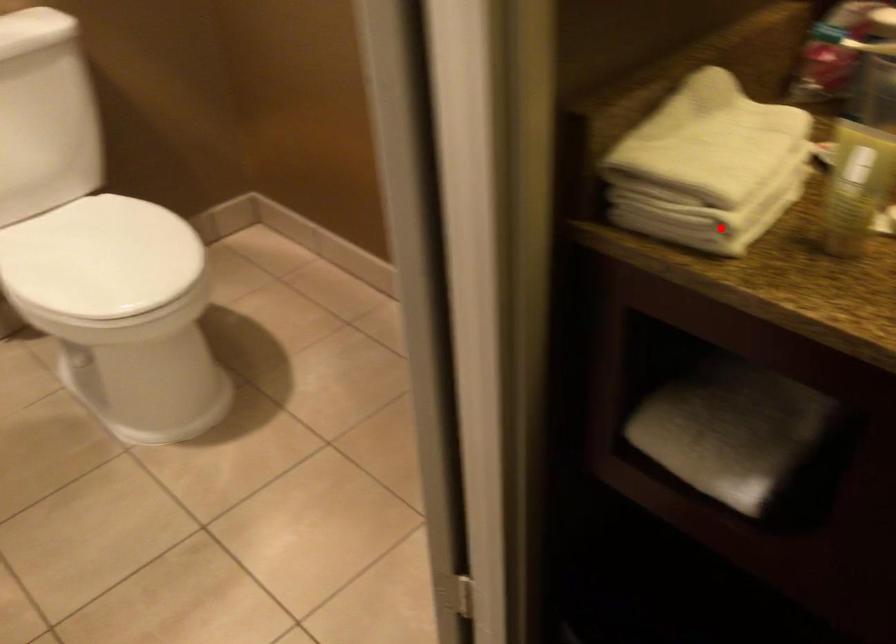
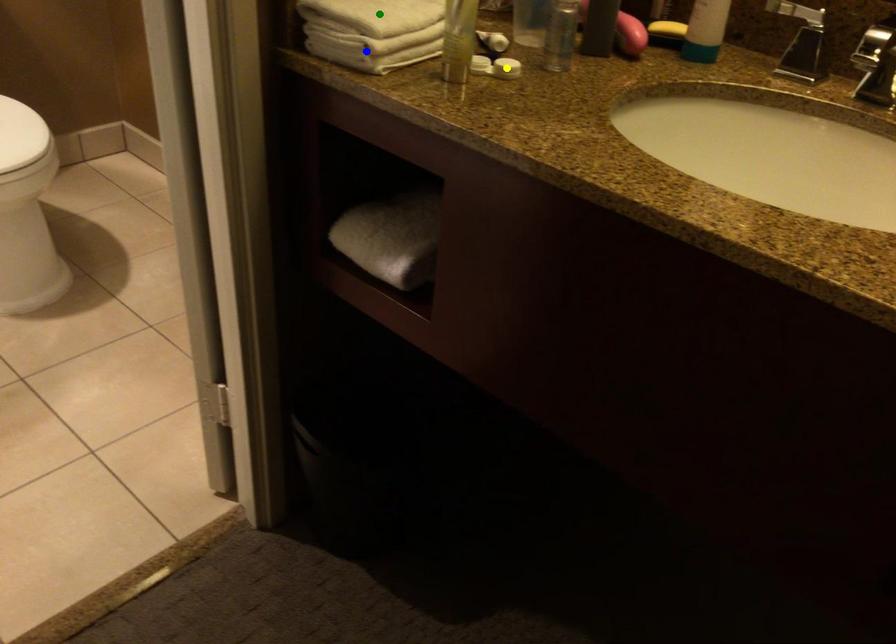
Question: I am providing you with two images of the same scene from different viewpoints. A red point is marked on the first image. You are given multiple points on the second image. Which point in image 2 represents the same 3d spot as the red point in image 1?

Choices:
 (A) yellow point
 (B) blue point
 (C) green point

Answer: (B)